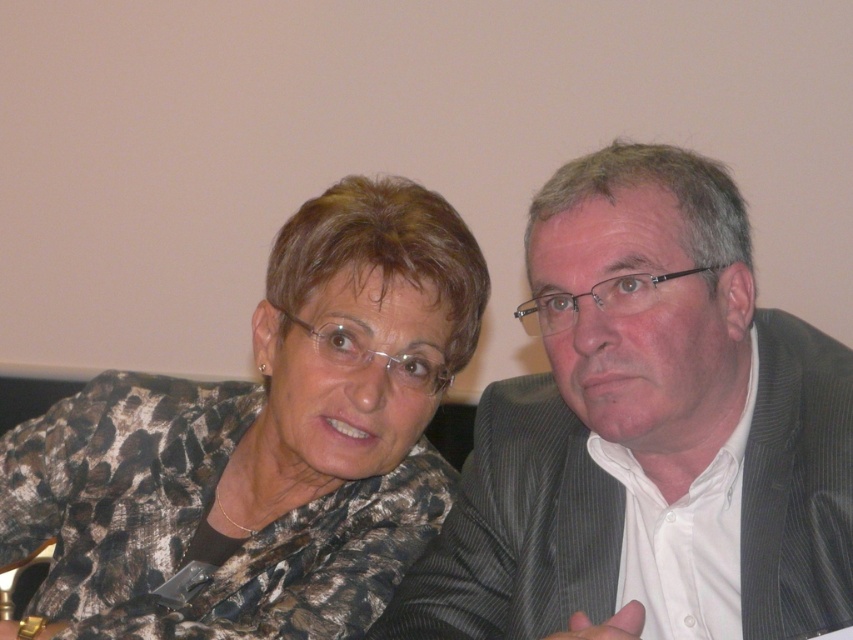
You are an event planner arranging seating for a meeting. You need to place a name tag on the table in front of the printed fabric blouse at center. Where should you position it relative to the gray striped suit at right?

The gray striped suit at right is to the right of the printed fabric blouse at center, so the name tag should be placed to the left of the gray striped suit at right to align with the printed fabric blouse at center.

You are a photographer setting up for a group photo. You need to position the gray striped suit at right and the printed fabric blouse at center according to their spatial relationship. Which one should be placed higher in the frame?

The gray striped suit at right should be placed higher in the frame because it is described as being above the printed fabric blouse at center.

You are an event planner trying to identify the location of the gray striped suit at right in the image. Using a coordinate system where the bottom left corner is the origin, can you determine its position?

The gray striped suit at right is located at the coordinate point of (647, 435).